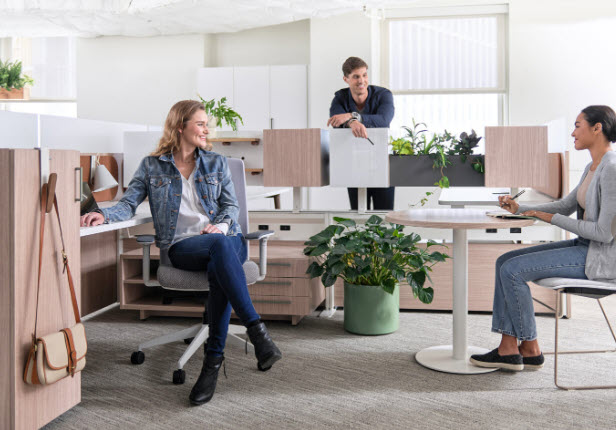
This screenshot has height=430, width=616. I want to click on chairs, so click(254, 266), click(580, 277).